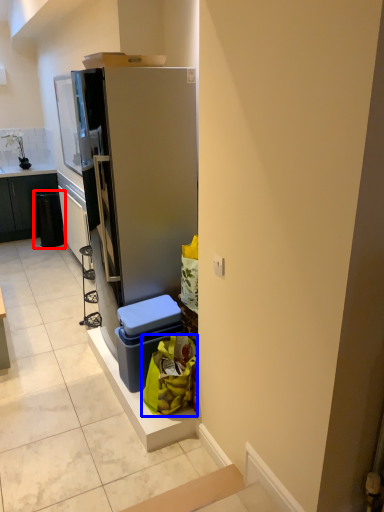
Question: Which of the following is the farthest to the observer, recycling bin (highlighted by a red box) or garbage (highlighted by a blue box)?

Choices:
 (A) recycling bin
 (B) garbage

Answer: (A)